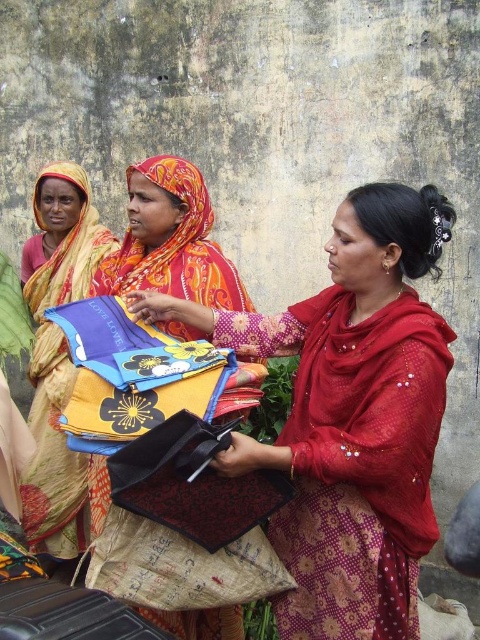
Is point (74, 273) farther from camera compared to point (181, 189)?

Yes, it is.

Who is more distant from viewer, (x=39, y=420) or (x=143, y=252)?

Positioned behind is point (x=39, y=420).

Find the location of a particular element. matte yellow sari at left is located at coordinates (58, 353).

Can you confirm if floral fabric scarf at center is bigger than floral silk shawl at center?

Correct, floral fabric scarf at center is larger in size than floral silk shawl at center.

Is floral fabric scarf at center smaller than floral silk shawl at center?

Actually, floral fabric scarf at center might be larger than floral silk shawl at center.

Where is `floral fabric scarf at center`? The height and width of the screenshot is (640, 480). floral fabric scarf at center is located at coordinates (170, 240).

Is matte red saree at center shorter than floral fabric scarf at center?

Yes.

Is matte red saree at center wider than floral fabric scarf at center?

Yes, matte red saree at center is wider than floral fabric scarf at center.

Which is behind, point (417, 474) or point (136, 230)?

Positioned behind is point (136, 230).

The height and width of the screenshot is (640, 480). Find the location of `matte red saree at center`. matte red saree at center is located at coordinates (350, 416).